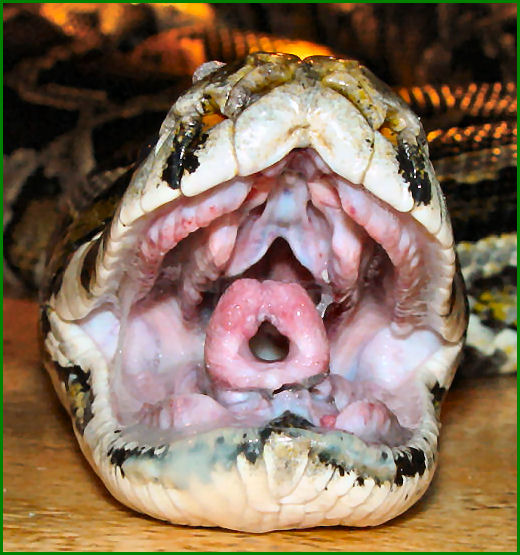
What are the coordinates of `light/glow` in the screenshot? It's located at (104, 16).